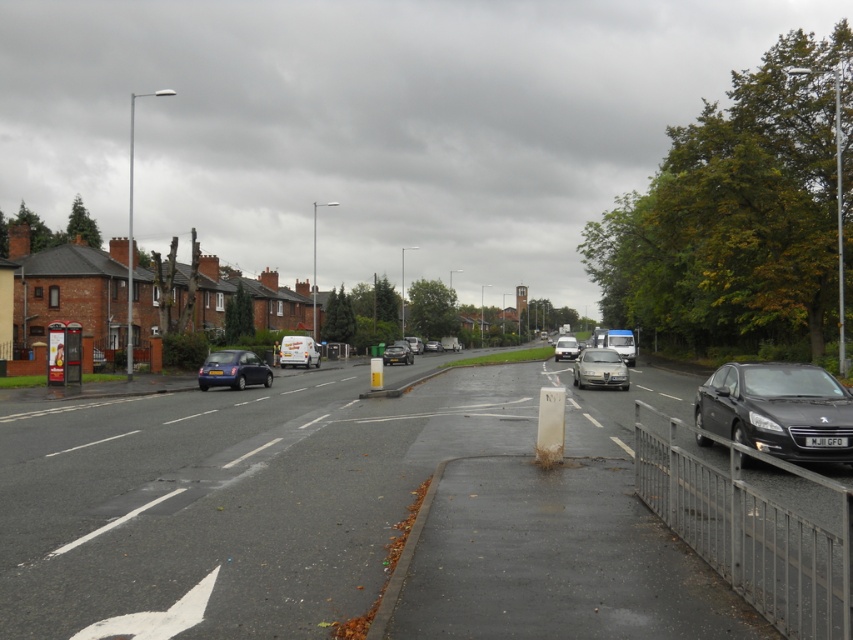
Is point (303, 339) farther from camera compared to point (563, 340)?

No, (303, 339) is in front of (563, 340).

Is white matte van at center wider than silver metallic van at center?

No.

You are a GUI agent. You are given a task and a screenshot of the screen. Output one action in this format:
    pyautogui.click(x=<x>, y=<y>)
    Task: Click on the white matte van at center
    This screenshot has height=640, width=853.
    Given the screenshot: What is the action you would take?
    pyautogui.click(x=299, y=352)

Does matte black car at right appear under metallic gray sedan at center?

No, matte black car at right is not below metallic gray sedan at center.

Which of these two, matte black car at right or metallic gray sedan at center, stands taller?

Standing taller between the two is metallic gray sedan at center.

At what (x,y) coordinates should I click in order to perform the action: click on matte black car at right. Please return your answer as a coordinate pair (x, y). Looking at the image, I should click on (778, 410).

Between metallic gray sedan at center and metallic silver van at center, which one has more height?

metallic silver van at center

Is metallic gray sedan at center thinner than metallic silver van at center?

Yes, metallic gray sedan at center is thinner than metallic silver van at center.

What do you see at coordinates (601, 369) in the screenshot? I see `metallic gray sedan at center` at bounding box center [601, 369].

Identify the location of metallic gray sedan at center. The image size is (853, 640). (601, 369).